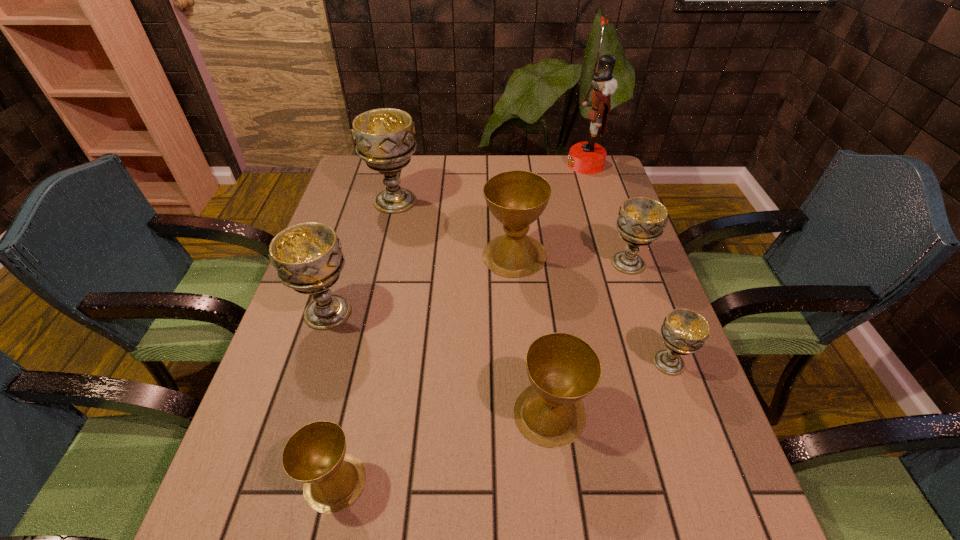
Where is `free space that is in between the smallest white chalice and the second tallest object`? The width and height of the screenshot is (960, 540). free space that is in between the smallest white chalice and the second tallest object is located at coordinates (532, 282).

What are the coordinates of `free point between the red nutcracker and the nearest brown chalice` in the screenshot? It's located at (460, 323).

Locate an element on the screen. empty location between the second tallest object and the nearest white chalice is located at coordinates (532, 282).

This screenshot has width=960, height=540. I want to click on object that is the fifth nearest to the second biggest white chalice, so click(x=641, y=220).

At what (x,y) coordinates should I click in order to perform the action: click on object that ranks as the fifth closest to the farthest brown chalice. Please return your answer as a coordinate pair (x, y). Looking at the image, I should click on (562, 368).

Locate an element on the screen. The image size is (960, 540). chalice that can be found as the second closest to the second farthest object is located at coordinates (307, 256).

The height and width of the screenshot is (540, 960). Identify the location of chalice that stands as the closest to the fifth farthest object. (315, 454).

Locate which white chalice ranks second in proximity to the farthest brown chalice. Please provide its 2D coordinates. Your answer should be formatted as a tuple, i.e. [(x, y)], where the tuple contains the x and y coordinates of a point satisfying the conditions above.

[(384, 137)]

Identify which white chalice is the closest to the second smallest white chalice. Please provide its 2D coordinates. Your answer should be formatted as a tuple, i.e. [(x, y)], where the tuple contains the x and y coordinates of a point satisfying the conditions above.

[(684, 331)]

Locate an element on the screen. This screenshot has height=540, width=960. the third closest brown chalice to the second tallest object is located at coordinates (315, 454).